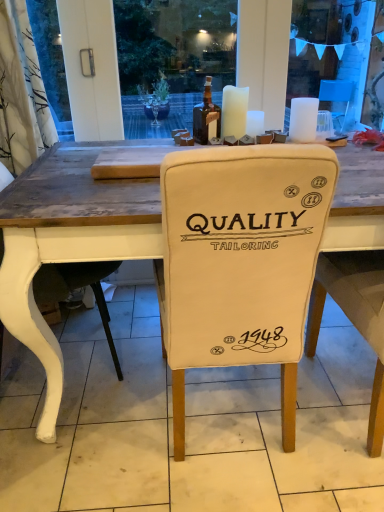
The height and width of the screenshot is (512, 384). Describe the element at coordinates (188, 425) in the screenshot. I see `white fabric chair cover at center` at that location.

Describe the element at coordinates (255, 123) in the screenshot. The width and height of the screenshot is (384, 512). I see `white wax candle at center, acting as the second candle starting from the right` at that location.

Where is `white fabric chair at left`? The height and width of the screenshot is (512, 384). white fabric chair at left is located at coordinates (77, 288).

This screenshot has height=512, width=384. Find the location of `white fabric chair at center`. white fabric chair at center is located at coordinates (68, 243).

Where is `brown glass bottle at upper center`? brown glass bottle at upper center is located at coordinates (206, 117).

Is white fabric chair at left facing away from white wax candle at center, the 2th candle in the left-to-right sequence?

white fabric chair at left does not have its back to white wax candle at center, the 2th candle in the left-to-right sequence.

Consider the image. Which of these two, white fabric chair at left or white wax candle at center, acting as the second candle starting from the right, is bigger?

Bigger between the two is white fabric chair at left.

Based on the photo, looking at their sizes, would you say white fabric chair at left is wider or thinner than white wax candle at center, acting as the second candle starting from the right?

Clearly, white fabric chair at left has more width compared to white wax candle at center, acting as the second candle starting from the right.

Is white fabric chair cover at center positioned before white fabric chair at center?

No, the depth of white fabric chair cover at center is greater than that of white fabric chair at center.

Is white fabric chair cover at center completely or partially outside of white fabric chair at center?

That's correct, white fabric chair cover at center is outside of white fabric chair at center.

Is white fabric chair cover at center positioned with its back to white fabric chair at center?

No, white fabric chair cover at center is not facing away from white fabric chair at center.

Is white wax candle at center, acting as the second candle starting from the right, directly adjacent to white matte candle at upper center, which is the first candle from left to right?

Absolutely, white wax candle at center, acting as the second candle starting from the right, is next to and touching white matte candle at upper center, which is the first candle from left to right.

Is white wax candle at center, acting as the second candle starting from the right, in front of or behind white matte candle at upper center, which is the first candle from left to right, in the image?

Visually, white wax candle at center, acting as the second candle starting from the right, is located behind white matte candle at upper center, which is the first candle from left to right.

Which is behind, point (246, 127) or point (235, 137)?

The point (246, 127) is behind.

From the image's perspective, is white wax candle at center, acting as the second candle starting from the right, below white matte candle at upper center, which is the first candle from left to right?

Yes, from the image's perspective, white wax candle at center, acting as the second candle starting from the right, is beneath white matte candle at upper center, which is the first candle from left to right.

Which of these two, white matte candle at upper center, acting as the 3th candle starting from the left, or white fabric chair at center, is bigger?

Bigger between the two is white fabric chair at center.

Is white matte candle at upper center, acting as the 3th candle starting from the left, facing away from white fabric chair at center?

That's not correct — white matte candle at upper center, acting as the 3th candle starting from the left, is not looking away from white fabric chair at center.

Can you confirm if white matte candle at upper center, which appears as the 1th candle when viewed from the right, is taller than white fabric chair at center?

Incorrect, the height of white matte candle at upper center, which appears as the 1th candle when viewed from the right, is not larger of that of white fabric chair at center.

From the image's perspective, who appears lower, white matte candle at upper center, which appears as the 1th candle when viewed from the right, or white fabric chair at center?

white fabric chair at center appears lower in the image.

From the image's perspective, is white fabric chair cover at center located beneath white wax candle at center, the 2th candle in the left-to-right sequence?

Indeed, from the image's perspective, white fabric chair cover at center is shown beneath white wax candle at center, the 2th candle in the left-to-right sequence.

Is point (42, 507) positioned behind point (251, 133)?

No, (42, 507) is in front of (251, 133).

Considering the relative positions of white fabric chair cover at center and brown glass bottle at upper center in the image provided, is white fabric chair cover at center behind brown glass bottle at upper center?

No, it is not.

In the scene shown: Does white fabric chair cover at center have a lesser height compared to brown glass bottle at upper center?

Yes, white fabric chair cover at center is shorter than brown glass bottle at upper center.

Based on the photo, is white fabric chair cover at center surrounding brown glass bottle at upper center?

No, brown glass bottle at upper center is not inside white fabric chair cover at center.

Is white fabric chair cover at center bigger or smaller than brown glass bottle at upper center?

In the image, white fabric chair cover at center appears to be larger than brown glass bottle at upper center.

Can you confirm if brown glass bottle at upper center is wider than white fabric chair cover at center?

No.

Which is correct: brown glass bottle at upper center is inside white fabric chair cover at center, or outside of it?

brown glass bottle at upper center exists outside the volume of white fabric chair cover at center.

Identify the location of bottle that appears above the white fabric chair cover at center (from the image's perspective). The image size is (384, 512). (206, 117).

Is brown glass bottle at upper center far away from white fabric chair cover at center?

Indeed, brown glass bottle at upper center is not near white fabric chair cover at center.

Find the location of `the 2nd candle to the right when counting from the white fabric chair at left`. the 2nd candle to the right when counting from the white fabric chair at left is located at coordinates click(255, 123).

This screenshot has width=384, height=512. Find the location of `tile on the left of white fabric chair at center`. tile on the left of white fabric chair at center is located at coordinates (188, 425).

Based on their spatial positions, is white matte candle at upper center, acting as the 3th candle starting from the left, or white fabric chair at left closer to white fabric chair cover at center?

The object closer to white fabric chair cover at center is white fabric chair at left.

From the image, which object appears to be farther from brown glass bottle at upper center, white matte candle at upper center, acting as the 3th candle starting from the left, or white fabric chair cover at center?

white fabric chair cover at center is positioned further to the anchor brown glass bottle at upper center.

Considering their positions, is white matte candle at upper center, the 3th candle when ordered from right to left, positioned closer to brown glass bottle at upper center than white fabric chair at left?

white matte candle at upper center, the 3th candle when ordered from right to left, lies closer to brown glass bottle at upper center than the other object.

From the image, which object appears to be nearer to white wax candle at center, acting as the second candle starting from the right, white matte candle at upper center, the 3th candle when ordered from right to left, or white matte candle at upper center, acting as the 3th candle starting from the left?

white matte candle at upper center, the 3th candle when ordered from right to left, is positioned closer to the anchor white wax candle at center, acting as the second candle starting from the right.

Considering their positions, is white fabric chair at center positioned closer to white fabric chair at left than white matte candle at upper center, which appears as the 1th candle when viewed from the right?

white fabric chair at center lies closer to white fabric chair at left than the other object.

Estimate the real-world distances between objects in this image. Which object is further from white fabric chair at left, white matte candle at upper center, the 3th candle when ordered from right to left, or white fabric chair cover at center?

Among the two, white matte candle at upper center, the 3th candle when ordered from right to left, is located further to white fabric chair at left.

Looking at the image, which one is located closer to white fabric chair at left, white fabric chair cover at center or white matte candle at upper center, which is the first candle from left to right?

white fabric chair cover at center lies closer to white fabric chair at left than the other object.

Estimate the real-world distances between objects in this image. Which object is closer to white fabric chair at left, white matte candle at upper center, which appears as the 1th candle when viewed from the right, or white matte candle at upper center, the 3th candle when ordered from right to left?

white matte candle at upper center, the 3th candle when ordered from right to left, lies closer to white fabric chair at left than the other object.

You are a GUI agent. You are given a task and a screenshot of the screen. Output one action in this format:
    pyautogui.click(x=<x>, y=<y>)
    Task: Click on the bottle situated between white fabric chair at left and white matte candle at upper center, which is the first candle from left to right, from left to right
    The height and width of the screenshot is (512, 384).
    Given the screenshot: What is the action you would take?
    pyautogui.click(x=206, y=117)

Locate an element on the screen. The image size is (384, 512). candle between brown glass bottle at upper center and white wax candle at center, the 2th candle in the left-to-right sequence, in the horizontal direction is located at coordinates (234, 111).

Find the location of `chair between white matte candle at upper center, which appears as the 1th candle when viewed from the right, and white fabric chair cover at center, in the vertical direction`. chair between white matte candle at upper center, which appears as the 1th candle when viewed from the right, and white fabric chair cover at center, in the vertical direction is located at coordinates (77, 288).

Locate an element on the screen. table between brown glass bottle at upper center and white fabric chair cover at center in the vertical direction is located at coordinates (68, 243).